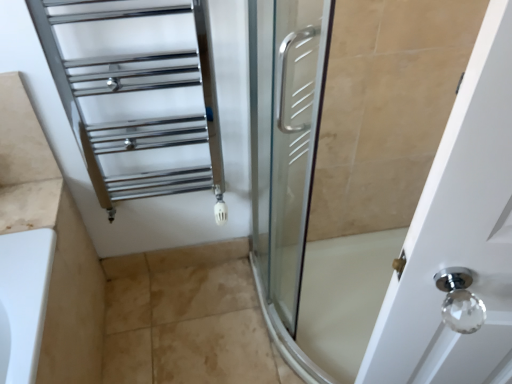
Locate an element on the screen. This screenshot has width=512, height=384. beige tile at lower center is located at coordinates (197, 254).

Describe the element at coordinates (197, 254) in the screenshot. I see `beige tile at lower center` at that location.

Measure the distance between point (159, 142) and camera.

The distance of point (159, 142) from camera is 1.32 meters.

Describe the element at coordinates (136, 94) in the screenshot. I see `chrome/metallic towel rack at upper left` at that location.

At what (x,y) coordinates should I click in order to perform the action: click on chrome/metallic towel rack at upper left. Please return your answer as a coordinate pair (x, y). Image resolution: width=512 pixels, height=384 pixels. Looking at the image, I should click on (136, 94).

The image size is (512, 384). Identify the location of beige tile at lower center. (197, 254).

Between chrome/metallic towel rack at upper left and beige tile at lower center, which one appears on the right side from the viewer's perspective?

beige tile at lower center.

Considering the relative positions of chrome/metallic towel rack at upper left and beige tile at lower center in the image provided, is chrome/metallic towel rack at upper left in front of beige tile at lower center?

Yes, it is.

Does point (130, 53) lie behind point (151, 262)?

That is False.

From the image's perspective, which one is positioned higher, chrome/metallic towel rack at upper left or beige tile at lower center?

chrome/metallic towel rack at upper left is shown above in the image.

From a real-world perspective, who is located higher, chrome/metallic towel rack at upper left or beige tile at lower center?

chrome/metallic towel rack at upper left is physically above.

Is chrome/metallic towel rack at upper left thinner than beige tile at lower center?

Incorrect, the width of chrome/metallic towel rack at upper left is not less than that of beige tile at lower center.

Does chrome/metallic towel rack at upper left have a greater height compared to beige tile at lower center?

Correct, chrome/metallic towel rack at upper left is much taller as beige tile at lower center.

Considering the relative sizes of chrome/metallic towel rack at upper left and beige tile at lower center in the image provided, is chrome/metallic towel rack at upper left bigger than beige tile at lower center?

Indeed, chrome/metallic towel rack at upper left has a larger size compared to beige tile at lower center.

Can beige tile at lower center be found inside chrome/metallic towel rack at upper left?

No, chrome/metallic towel rack at upper left does not contain beige tile at lower center.

Are chrome/metallic towel rack at upper left and beige tile at lower center beside each other?

No, chrome/metallic towel rack at upper left is not making contact with beige tile at lower center.

Is chrome/metallic towel rack at upper left looking in the opposite direction of beige tile at lower center?

No, chrome/metallic towel rack at upper left's orientation is not away from beige tile at lower center.

How distant is chrome/metallic towel rack at upper left from beige tile at lower center?

chrome/metallic towel rack at upper left is 22.83 inches away from beige tile at lower center.

Find the location of a particular element. Image resolution: width=512 pixels, height=384 pixels. tile located below the chrome/metallic towel rack at upper left (from the image's perspective) is located at coordinates (197, 254).

Is beige tile at lower center at the right side of chrome/metallic towel rack at upper left?

Yes.

Which object is more forward, beige tile at lower center or chrome/metallic towel rack at upper left?

Positioned in front is chrome/metallic towel rack at upper left.

Between point (200, 255) and point (159, 122), which one is positioned behind?

The point (200, 255) is farther.

From the image's perspective, would you say beige tile at lower center is shown under chrome/metallic towel rack at upper left?

Yes, from the image's perspective, beige tile at lower center is beneath chrome/metallic towel rack at upper left.

From a real-world perspective, which is physically above, beige tile at lower center or chrome/metallic towel rack at upper left?

chrome/metallic towel rack at upper left, from a real-world perspective.

Which object is wider, beige tile at lower center or chrome/metallic towel rack at upper left?

With larger width is chrome/metallic towel rack at upper left.

Which of these two, beige tile at lower center or chrome/metallic towel rack at upper left, stands shorter?

Standing shorter between the two is beige tile at lower center.

Considering the relative sizes of beige tile at lower center and chrome/metallic towel rack at upper left in the image provided, is beige tile at lower center smaller than chrome/metallic towel rack at upper left?

Indeed, beige tile at lower center has a smaller size compared to chrome/metallic towel rack at upper left.

Is beige tile at lower center spatially inside chrome/metallic towel rack at upper left, or outside of it?

beige tile at lower center lies outside chrome/metallic towel rack at upper left.

Is beige tile at lower center not near chrome/metallic towel rack at upper left?

That's not correct — beige tile at lower center is a little close to chrome/metallic towel rack at upper left.

Is beige tile at lower center turned away from chrome/metallic towel rack at upper left?

No, chrome/metallic towel rack at upper left is not at the back of beige tile at lower center.

Locate an element on the screen. This screenshot has width=512, height=384. cage that appears in front of the beige tile at lower center is located at coordinates (136, 94).

Identify the location of tile located underneath the chrome/metallic towel rack at upper left (from a real-world perspective). (197, 254).

What are the coordinates of `tile that appears on the right of chrome/metallic towel rack at upper left` in the screenshot? It's located at (197, 254).